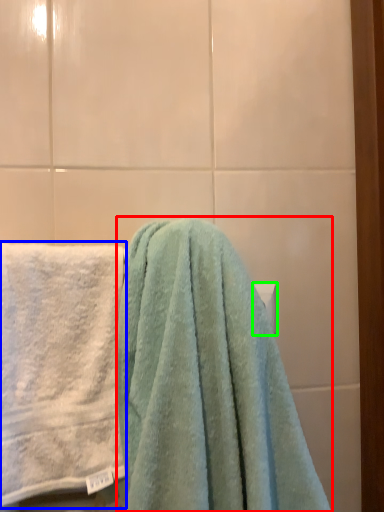
Question: Which is farther away from towel (highlighted by a red box)? towel (highlighted by a blue box) or towel bar (highlighted by a green box)?

Choices:
 (A) towel
 (B) towel bar

Answer: (B)